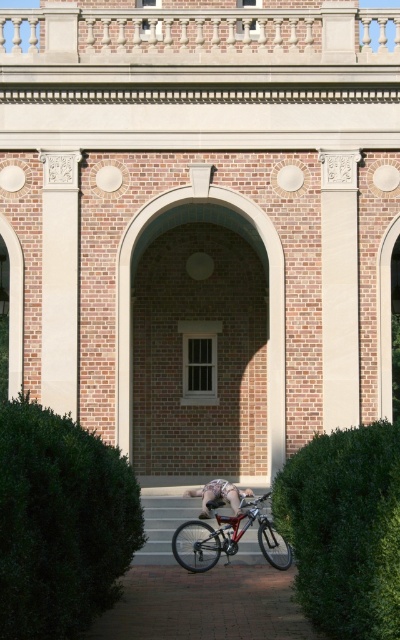
Does green leafy hedge at lower left have a greater height compared to shiny metallic bicycle at center?

Yes, green leafy hedge at lower left is taller than shiny metallic bicycle at center.

Does green leafy hedge at lower left appear over shiny metallic bicycle at center?

Yes, green leafy hedge at lower left is above shiny metallic bicycle at center.

Who is more distant from viewer, (4, 440) or (247, 525)?

The point (247, 525) is behind.

The image size is (400, 640). I want to click on green leafy hedge at lower left, so click(x=60, y=524).

Is point (374, 516) in front of point (206, 508)?

Yes.

Can you confirm if green leafy hedge at lower right is taller than skinny jeans at center?

Yes, green leafy hedge at lower right is taller than skinny jeans at center.

Who is more forward, (x=341, y=593) or (x=220, y=490)?

Point (x=341, y=593)

Find the location of a particular element. The width and height of the screenshot is (400, 640). green leafy hedge at lower right is located at coordinates (345, 529).

Does green leafy hedge at lower left have a lesser width compared to skinny jeans at center?

No.

Describe the element at coordinates (60, 524) in the screenshot. This screenshot has width=400, height=640. I see `green leafy hedge at lower left` at that location.

Which is behind, point (58, 428) or point (212, 486)?

The point (212, 486) is behind.

Image resolution: width=400 pixels, height=640 pixels. Find the location of `green leafy hedge at lower left`. green leafy hedge at lower left is located at coordinates (60, 524).